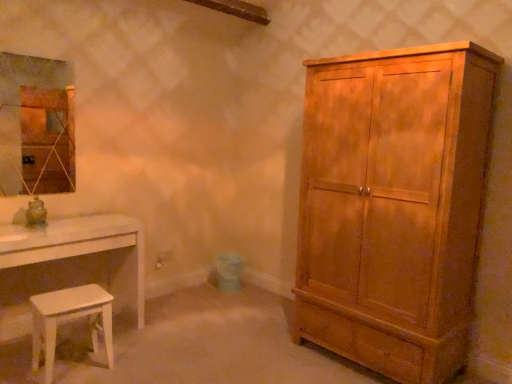
Image resolution: width=512 pixels, height=384 pixels. I want to click on white glossy stool at lower left, so click(67, 317).

What is the approximate width of white glossy stool at lower left?

It is 31.57 centimeters.

This screenshot has height=384, width=512. Describe the element at coordinates (394, 206) in the screenshot. I see `matte wood cabinet at right` at that location.

Measure the distance between matte glass mirror at upper left and camera.

matte glass mirror at upper left and camera are 2.74 meters apart from each other.

Identify the location of white glossy stool at lower left. (67, 317).

Measure the distance between matte glass mirror at upper left and matte wood cabinet at right.

2.06 meters.

Based on the photo, from the image's perspective, is matte glass mirror at upper left located beneath matte wood cabinet at right?

No.

From a real-world perspective, which object rests below the other?

From a 3D spatial view, matte wood cabinet at right is below.

Which object is further away from the camera taking this photo, matte glass mirror at upper left or matte wood cabinet at right?

matte glass mirror at upper left is more distant.

From a real-world perspective, is matte glass mirror at upper left located higher than white glossy table at lower left?

Yes.

Looking at their sizes, would you say matte glass mirror at upper left is wider or thinner than white glossy table at lower left?

matte glass mirror at upper left is thinner than white glossy table at lower left.

Who is shorter, matte glass mirror at upper left or white glossy table at lower left?

white glossy table at lower left.

Between white glossy stool at lower left and white glossy table at lower left, which one appears on the right side from the viewer's perspective?

white glossy stool at lower left is more to the right.

From a real-world perspective, between white glossy stool at lower left and white glossy table at lower left, who is vertically higher?

white glossy table at lower left is physically above.

Is white glossy stool at lower left completely or partially outside of white glossy table at lower left?

Yes, white glossy stool at lower left is outside of white glossy table at lower left.

From the image's perspective, would you say white glossy stool at lower left is positioned over matte wood cabinet at right?

No, from the image's perspective, white glossy stool at lower left is not on top of matte wood cabinet at right.

Can we say white glossy stool at lower left lies outside matte wood cabinet at right?

Indeed, white glossy stool at lower left is completely outside matte wood cabinet at right.

Which is behind, point (68, 302) or point (401, 220)?

The point (68, 302) is farther from the camera.

Is white glossy stool at lower left looking in the opposite direction of matte wood cabinet at right?

No.

Is matte glass mirror at upper left at the back of matte wood cabinet at right?

No, matte wood cabinet at right is not facing away from matte glass mirror at upper left.

Does point (406, 88) come farther from viewer compared to point (20, 116)?

No, it is not.

Which of these two, matte wood cabinet at right or matte glass mirror at upper left, is thinner?

Thinner between the two is matte glass mirror at upper left.

Is white glossy table at lower left far from matte glass mirror at upper left?

They are positioned close to each other.

Measure the distance from white glossy table at lower left to matte glass mirror at upper left.

white glossy table at lower left and matte glass mirror at upper left are 26.57 inches apart from each other.

Identify the location of mirror located on the left of white glossy table at lower left. (36, 125).

Is point (46, 265) behind point (54, 83)?

That is False.

Does point (131, 232) lie in front of point (469, 82)?

That is False.

Is white glossy table at lower left shorter than matte wood cabinet at right?

Correct, white glossy table at lower left is not as tall as matte wood cabinet at right.

Can you confirm if white glossy table at lower left is thinner than matte wood cabinet at right?

Yes, white glossy table at lower left is thinner than matte wood cabinet at right.

The width and height of the screenshot is (512, 384). I want to click on cabinetry lying below the matte glass mirror at upper left (from the image's perspective), so click(x=394, y=206).

Image resolution: width=512 pixels, height=384 pixels. What are the coordinates of `table lying on the right of matte glass mirror at upper left` in the screenshot? It's located at (69, 265).

When comparing their distances from matte glass mirror at upper left, does matte wood cabinet at right or white glossy table at lower left seem closer?

white glossy table at lower left.

Considering their positions, is matte glass mirror at upper left positioned further to white glossy stool at lower left than matte wood cabinet at right?

matte wood cabinet at right lies further to white glossy stool at lower left than the other object.

From the image, which object appears to be nearer to matte glass mirror at upper left, matte wood cabinet at right or white glossy stool at lower left?

Among the two, white glossy stool at lower left is located nearer to matte glass mirror at upper left.

Based on their spatial positions, is matte glass mirror at upper left or matte wood cabinet at right closer to white glossy table at lower left?

matte glass mirror at upper left.

Looking at the image, which one is located further to white glossy stool at lower left, matte wood cabinet at right or white glossy table at lower left?

Among the two, matte wood cabinet at right is located further to white glossy stool at lower left.

Estimate the real-world distances between objects in this image. Which object is further from matte wood cabinet at right, white glossy stool at lower left or white glossy table at lower left?

Based on the image, white glossy stool at lower left appears to be further to matte wood cabinet at right.

From the image, which object appears to be farther from white glossy stool at lower left, white glossy table at lower left or matte wood cabinet at right?

matte wood cabinet at right.

Based on their spatial positions, is white glossy stool at lower left or matte wood cabinet at right closer to white glossy table at lower left?

Among the two, white glossy stool at lower left is located nearer to white glossy table at lower left.

This screenshot has height=384, width=512. Find the location of `stool between white glossy table at lower left and matte wood cabinet at right from left to right`. stool between white glossy table at lower left and matte wood cabinet at right from left to right is located at coordinates (67, 317).

Find the location of `table that lies between matte glass mirror at upper left and white glossy stool at lower left from top to bottom`. table that lies between matte glass mirror at upper left and white glossy stool at lower left from top to bottom is located at coordinates (69, 265).

In order to click on stool between matte glass mirror at upper left and matte wood cabinet at right in the horizontal direction in this screenshot , I will do `click(67, 317)`.

The width and height of the screenshot is (512, 384). What are the coordinates of `table between matte glass mirror at upper left and matte wood cabinet at right in the horizontal direction` in the screenshot? It's located at (69, 265).